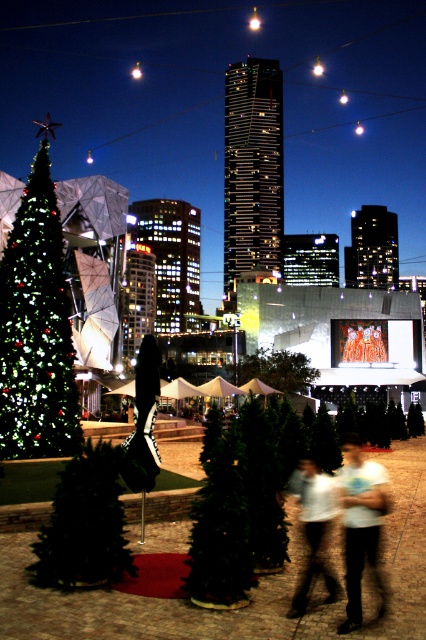
You are standing at the center of the city square and see the white cotton shirt at center. If you walk straight ahead, will you walk towards the red carpet or the large, illuminated Christmas tree on the left?

The white cotton shirt at center is located at point (313,525). Since the shirt is at the center, walking straight ahead would lead you towards the red carpet, which is positioned beneath one of the trees in the semi circle arrangement, rather than towards the Christmas tree on the left.

You are a city planner who needs to place a new bench between the green matte tree at lower left and the green matte christmas tree at center. The bench requires 20 feet of space. Is there enough space between them?

The distance between the green matte tree at lower left and the green matte christmas tree at center is 19.89 feet, which is slightly less than the required 20 feet. Therefore, there isn not enough space to place the bench between them.